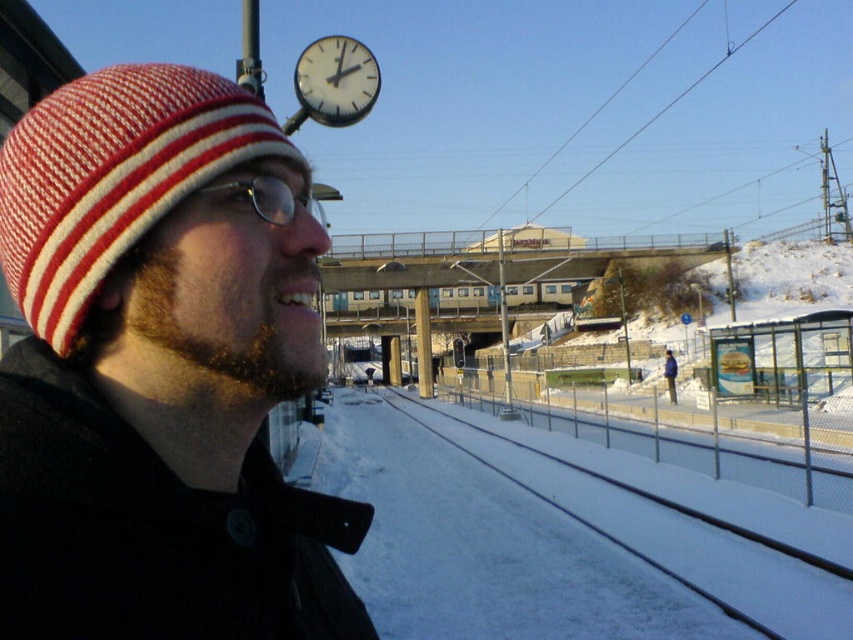
Question: Is the position of red and white striped knit cap at left less distant than that of clear plastic glasses at upper center?

Choices:
 (A) no
 (B) yes

Answer: (B)

Question: Among these points, which one is farthest from the camera?

Choices:
 (A) (36, 324)
 (B) (322, 81)
 (C) (795, 598)

Answer: (C)

Question: Can you confirm if snow-covered metal train track at lower center is thinner than white glossy clock at upper center?

Choices:
 (A) no
 (B) yes

Answer: (A)

Question: Which point is farther to the camera?

Choices:
 (A) red and white striped knit cap at left
 (B) clear plastic glasses at upper center
 (C) knitted woolen hat at upper left

Answer: (B)

Question: Which object appears closest to the camera in this image?

Choices:
 (A) white glossy clock at upper center
 (B) red and white striped knit cap at left
 (C) clear plastic glasses at upper center

Answer: (B)

Question: Can you confirm if red and white striped knit cap at left is positioned below white glossy clock at upper center?

Choices:
 (A) no
 (B) yes

Answer: (B)